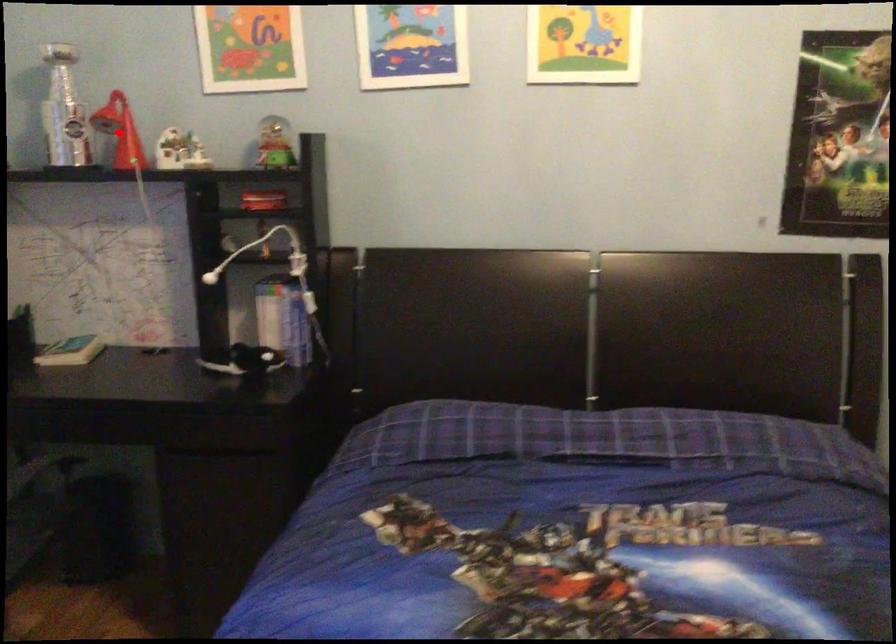
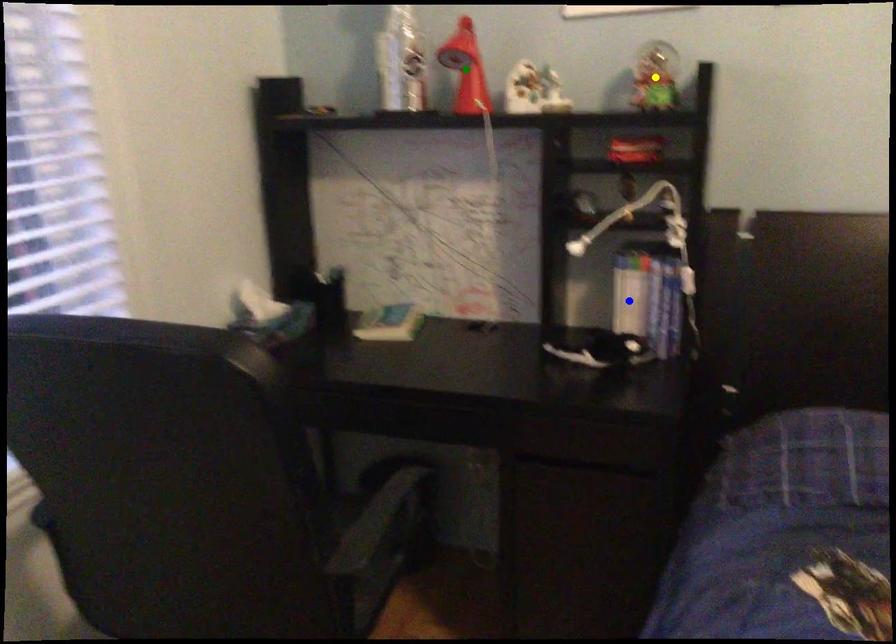
Question: I am providing you with two images of the same scene from different viewpoints. A red point is marked on the first image. You are given multiple points on the second image. Which point in image 2 is actually the same real-world point as the red point in image 1?

Choices:
 (A) yellow point
 (B) blue point
 (C) green point

Answer: (C)